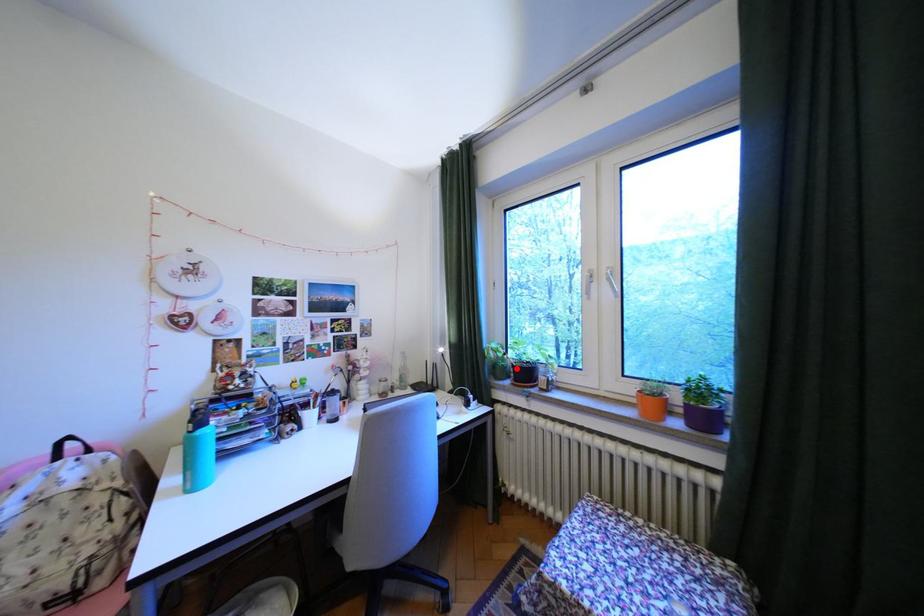
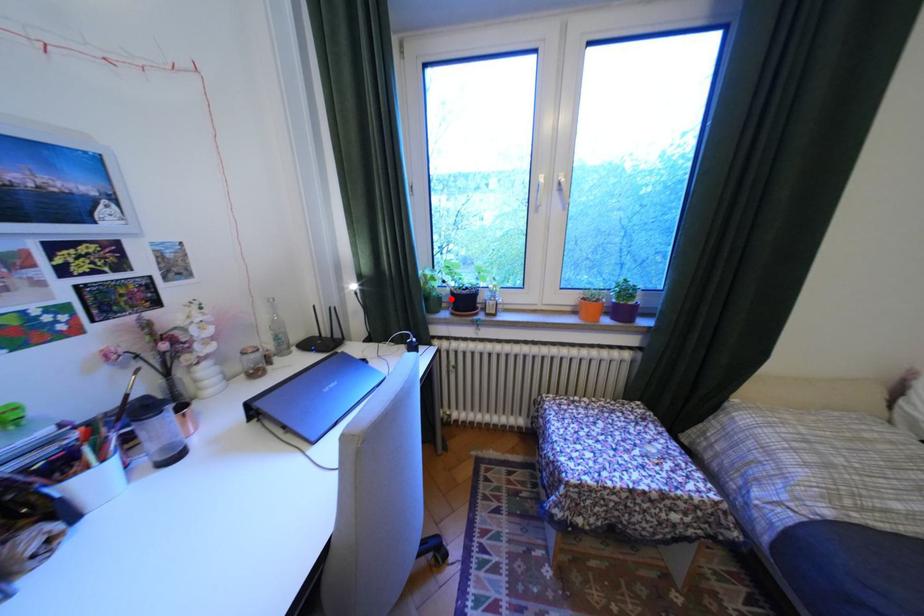
I am providing you with two images of the same scene from different viewpoints. A red point is marked on the first image and another point is marked on the second image. Does the point marked in image1 correspond to the same location as the one in image2?

Yes